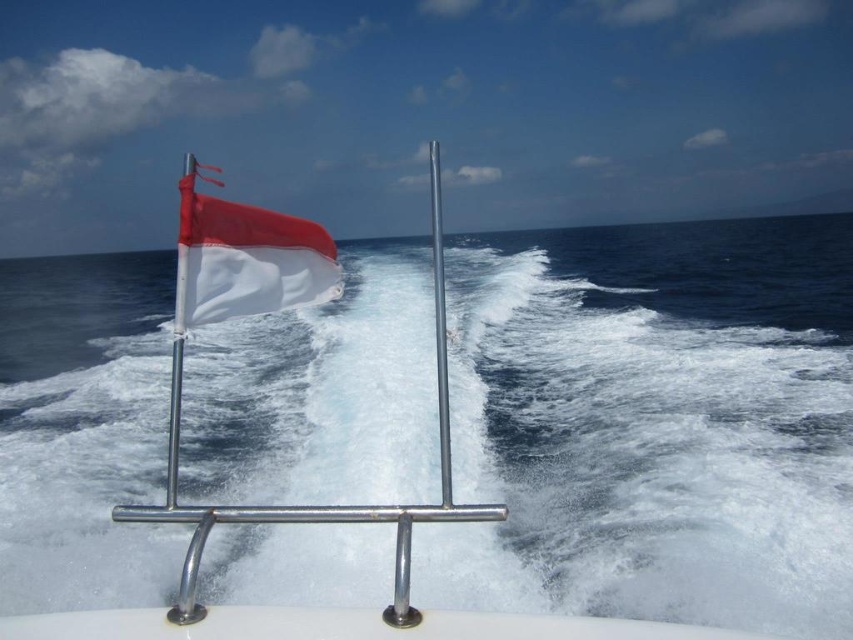
Question: Is white foam water at center below red/white flag at left?

Choices:
 (A) yes
 (B) no

Answer: (B)

Question: Among these points, which one is farthest from the camera?

Choices:
 (A) (170, 387)
 (B) (437, 400)
 (C) (238, 314)

Answer: (A)

Question: Which of the following is the farthest from the observer?

Choices:
 (A) polished metal pole at center
 (B) white matte flag at upper left
 (C) white foam water at center

Answer: (C)

Question: Which of the following is the farthest from the observer?

Choices:
 (A) (183, 342)
 (B) (212, 362)

Answer: (B)

Question: Can you confirm if white foam water at center is bigger than polished metal pole at center?

Choices:
 (A) yes
 (B) no

Answer: (A)

Question: Can you confirm if polished metal pole at center is positioned to the left of red/white flag at left?

Choices:
 (A) no
 (B) yes

Answer: (A)